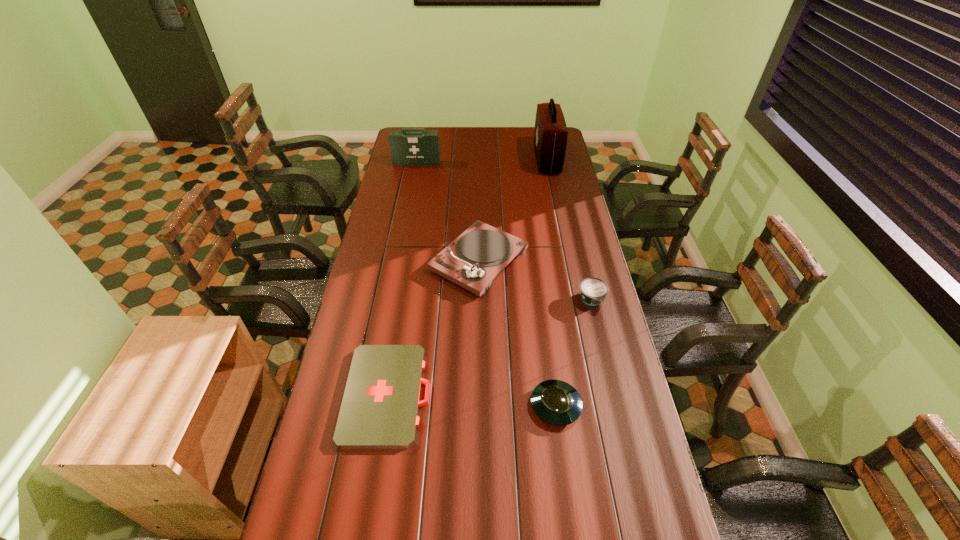
This screenshot has width=960, height=540. What are the coordinates of `vacant area situated 0.110m on the side of the tallest object with the cross symbol` in the screenshot? It's located at (514, 160).

Locate an element on the screen. free region located 0.290m on the front-facing side of the fifth shortest object is located at coordinates (410, 199).

Identify the location of vacant region located 0.230m on the left of the phonograph_record. The width and height of the screenshot is (960, 540). (371, 260).

Where is `blank space located on the back of the yogurt`? Image resolution: width=960 pixels, height=540 pixels. blank space located on the back of the yogurt is located at coordinates (586, 275).

Where is `free region located on the back of the saucer`? free region located on the back of the saucer is located at coordinates (551, 370).

Identify the location of vacant area situated on handle side the shortest first-aid kit. The width and height of the screenshot is (960, 540). (533, 394).

Find the location of `object that is at the far edge`. object that is at the far edge is located at coordinates (550, 136).

Find the location of `the first aid kit that is positioned at the right edge`. the first aid kit that is positioned at the right edge is located at coordinates (550, 136).

Identify the location of yogurt that is at the right edge. (593, 291).

Identify the location of saucer at the right edge. This screenshot has width=960, height=540. (555, 402).